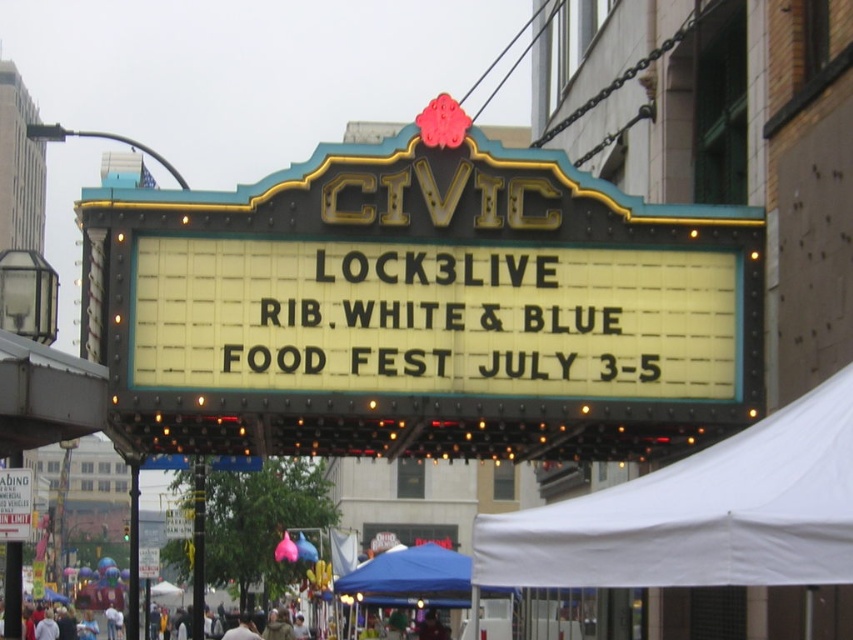
In the scene shown: You are standing in the festival area and want to locate the main event sign. According to the image, where is the gold metallic marquee at center positioned in 2D coordinates?

The gold metallic marquee at center is positioned at the 2D coordinates point (422, 308).

You are setting up for the event and need to know which object is wider. You see the blue fabric canopy at lower center and the white paper sign at upper center. Which one is wider?

The blue fabric canopy at lower center is wider than the white paper sign at upper center.